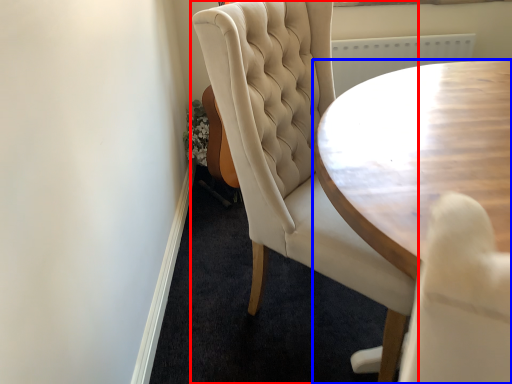
Question: Which object is closer to the camera taking this photo, chair (highlighted by a red box) or coffee table (highlighted by a blue box)?

Choices:
 (A) chair
 (B) coffee table

Answer: (B)